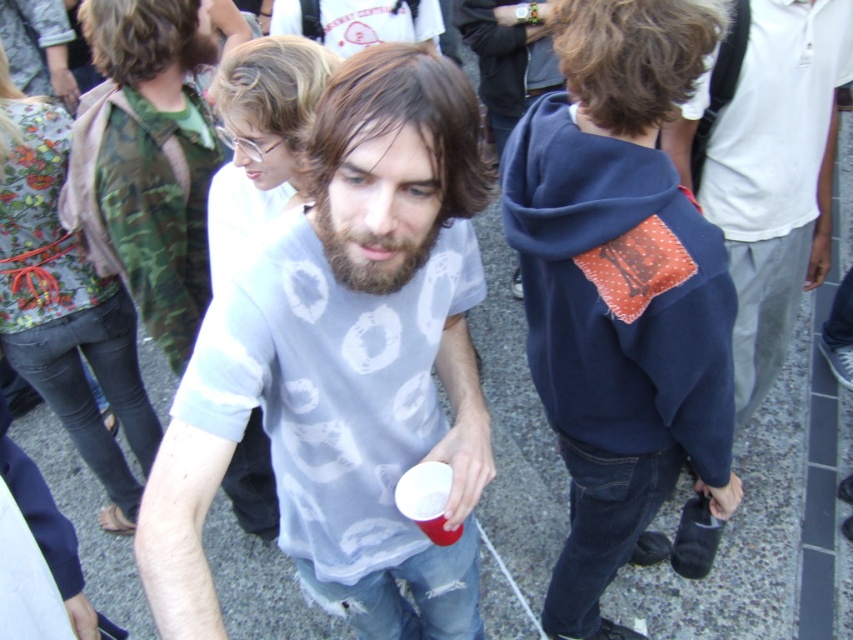
Question: Which point is closer to the camera?

Choices:
 (A) [306, 122]
 (B) [140, 28]

Answer: (A)

Question: Which point appears closest to the camera in this image?

Choices:
 (A) (471, 204)
 (B) (688, 131)
 (C) (650, 70)

Answer: (A)

Question: Does brown matte hair at center have a lesser width compared to blondehair at upper left?

Choices:
 (A) no
 (B) yes

Answer: (B)

Question: Can you confirm if white printed t-shirt at center is smaller than brown matte hair at center?

Choices:
 (A) no
 (B) yes

Answer: (A)

Question: Which point is farther from the camera taking this photo?

Choices:
 (A) (343, 225)
 (B) (370, 276)
 (C) (786, 70)

Answer: (C)

Question: Does blondehair at upper left appear under curly brown hair at upper left?

Choices:
 (A) yes
 (B) no

Answer: (A)